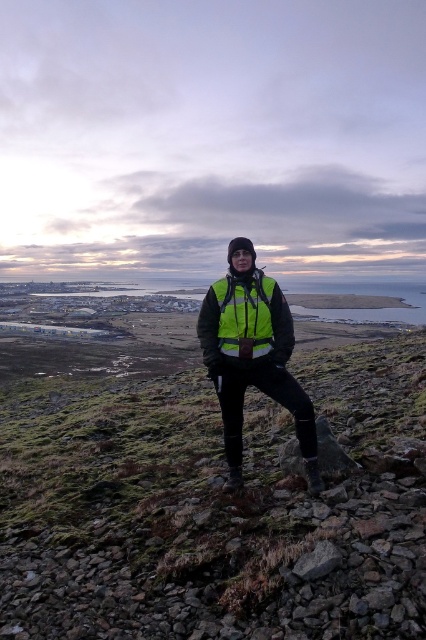
Question: Which of the following is the closest to the observer?

Choices:
 (A) neon yellow reflective vest at center
 (B) high visibility fabric safety vest at center

Answer: (A)

Question: Is reflective green vest at center in front of neon yellow reflective vest at center?

Choices:
 (A) no
 (B) yes

Answer: (B)

Question: Which is nearer to the neon yellow reflective vest at center?

Choices:
 (A) reflective green vest at center
 (B) high visibility fabric safety vest at center

Answer: (B)

Question: Is neon yellow reflective vest at center to the left of high visibility fabric safety vest at center from the viewer's perspective?

Choices:
 (A) yes
 (B) no

Answer: (B)

Question: Estimate the real-world distances between objects in this image. Which object is farther from the neon yellow reflective vest at center?

Choices:
 (A) reflective green vest at center
 (B) high visibility fabric safety vest at center

Answer: (A)

Question: Can you confirm if reflective green vest at center is positioned to the right of high visibility fabric safety vest at center?

Choices:
 (A) no
 (B) yes

Answer: (B)